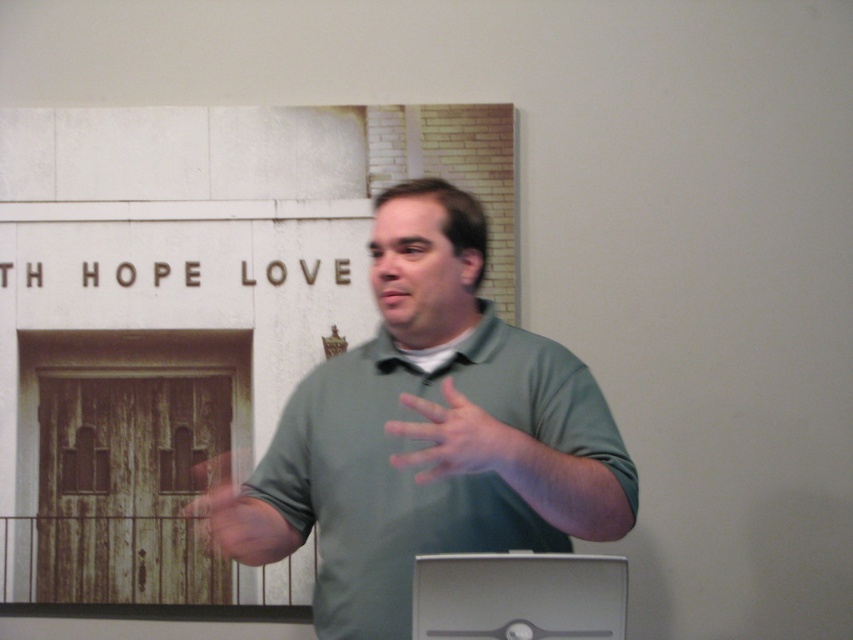
Question: Which point is farther to the camera?

Choices:
 (A) green matte shirt at center
 (B) matte green shirt at center
 (C) satin silver computer at lower center
 (D) wooden door at center

Answer: (D)

Question: Does green matte shirt at center appear on the right side of wooden door at center?

Choices:
 (A) yes
 (B) no

Answer: (A)

Question: Which point is farther to the camera?

Choices:
 (A) green matte shirt at center
 (B) wooden door at center
 (C) satin silver computer at lower center
 (D) matte green shirt at center

Answer: (B)

Question: Which point is farther from the camera taking this photo?

Choices:
 (A) (247, 563)
 (B) (485, 417)
 (C) (578, 506)

Answer: (A)

Question: Can you confirm if satin silver computer at lower center is positioned to the left of matte green shirt at center?

Choices:
 (A) no
 (B) yes

Answer: (A)

Question: Can you confirm if green matte shirt at center is smaller than wooden door at center?

Choices:
 (A) yes
 (B) no

Answer: (B)